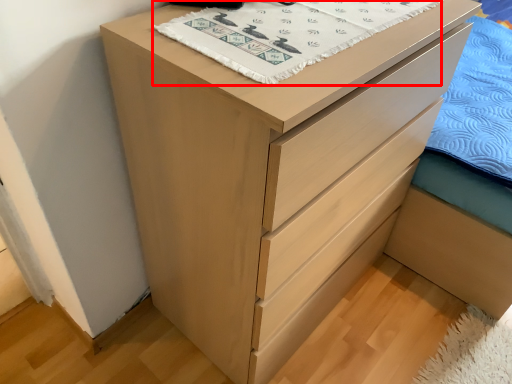
Question: From the image, what is the correct spatial relationship of blanket (annotated by the red box) in relation to bed frame?

Choices:
 (A) right
 (B) left

Answer: (B)